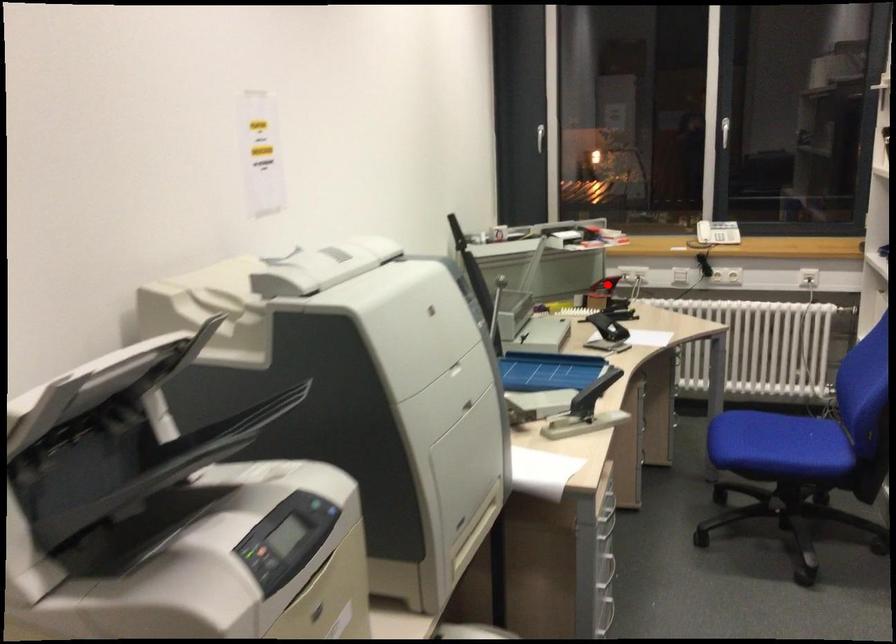
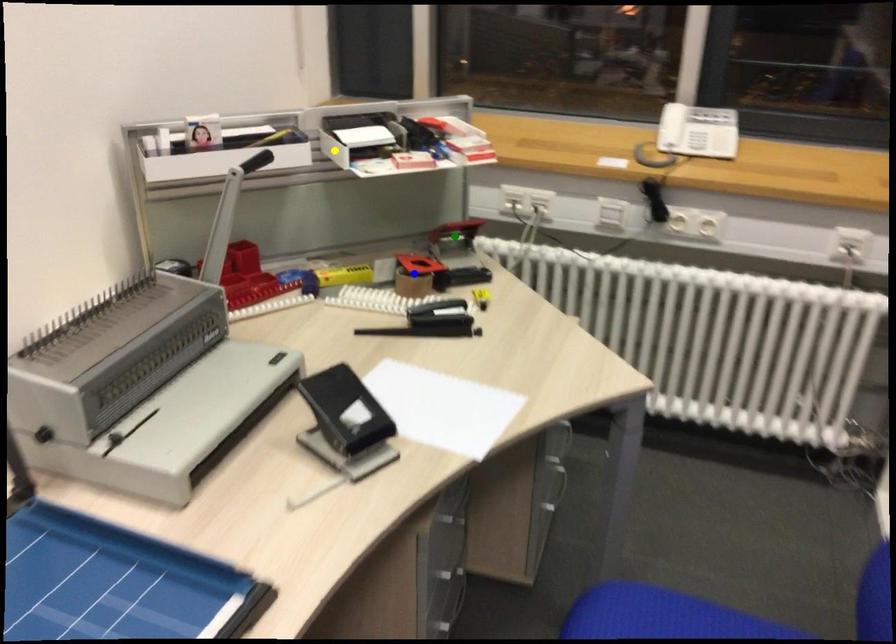
Question: I am providing you with two images of the same scene from different viewpoints. A red point is marked on the first image. You are given multiple points on the second image. Which point in image 2 represents the same 3d spot as the red point in image 1?

Choices:
 (A) green point
 (B) blue point
 (C) yellow point

Answer: (A)